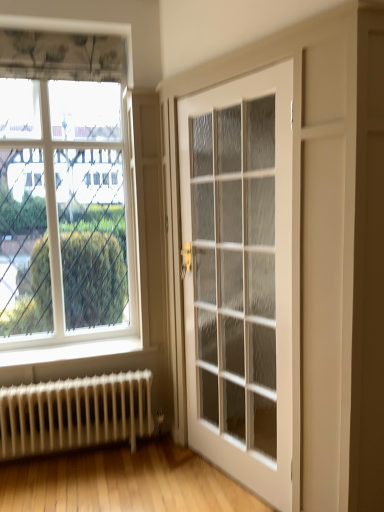
What are the coordinates of `free spot below white metal radiator at lower left (from a real-world perspective)` in the screenshot? It's located at (87, 454).